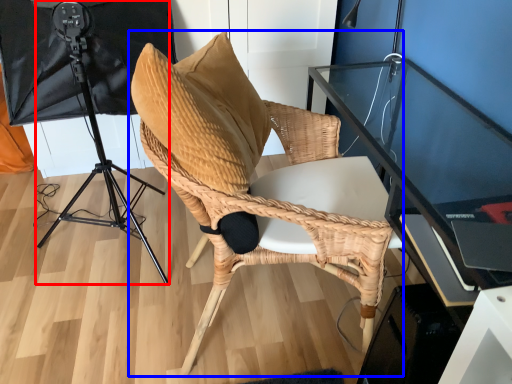
Question: Which object appears closest to the camera in this image, tripod (highlighted by a red box) or chair (highlighted by a blue box)?

Choices:
 (A) tripod
 (B) chair

Answer: (B)